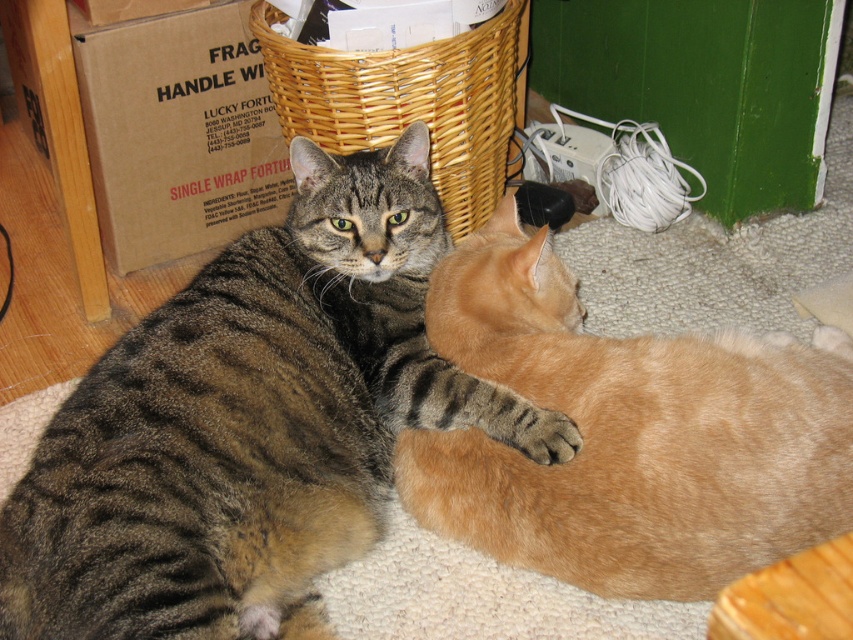
Question: Is woven brown basket at upper center wider than soft fur paw at lower center?

Choices:
 (A) no
 (B) yes

Answer: (B)

Question: Which point is closer to the camera?

Choices:
 (A) woven brown basket at upper center
 (B) orange fur cat at center
 (C) brown cardboard box at upper left
 (D) tabby fur cat at center

Answer: (D)

Question: Does tabby fur cat at center have a smaller size compared to brown cardboard box at upper left?

Choices:
 (A) yes
 (B) no

Answer: (B)

Question: Observing the image, what is the correct spatial positioning of brown cardboard box at upper left in reference to soft fur paw at lower center?

Choices:
 (A) above
 (B) below

Answer: (A)

Question: Estimate the real-world distances between objects in this image. Which object is closer to the soft fur paw at lower center?

Choices:
 (A) orange fur cat at center
 (B) brown cardboard box at upper left

Answer: (A)

Question: Which object is positioned closest to the tabby fur cat at center?

Choices:
 (A) brown cardboard box at upper left
 (B) soft fur paw at lower center

Answer: (B)